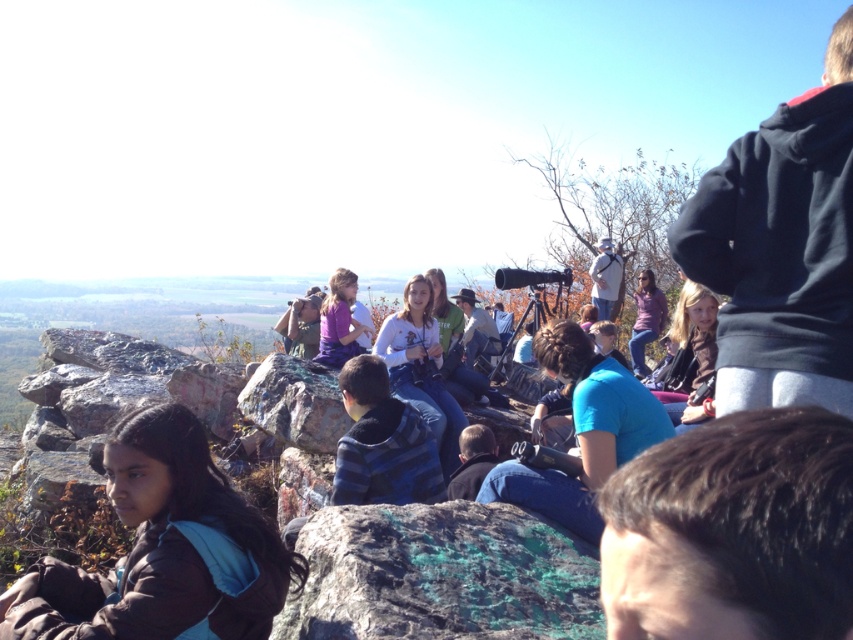
Is the position of green marbled rock at center less distant than that of matte purple shirt at center?

Yes, green marbled rock at center is in front of matte purple shirt at center.

Is green marbled rock at center to the left of matte purple shirt at center from the viewer's perspective?

In fact, green marbled rock at center is to the right of matte purple shirt at center.

Is point (355, 561) positioned behind point (332, 326)?

No, (355, 561) is in front of (332, 326).

Where is `green marbled rock at center`? Image resolution: width=853 pixels, height=640 pixels. green marbled rock at center is located at coordinates (440, 576).